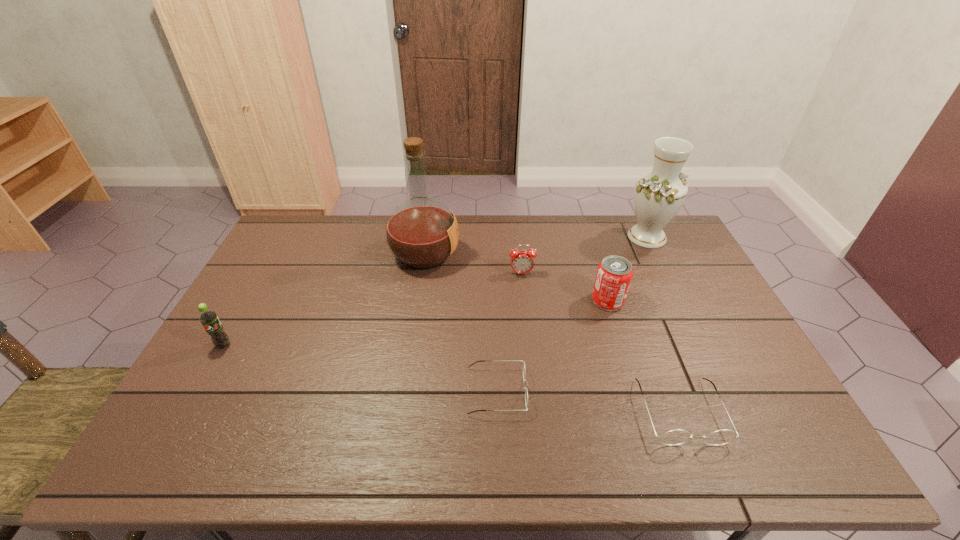
Locate an element on the screen. The height and width of the screenshot is (540, 960). vacant space located on the front-facing side of the shortest object is located at coordinates (629, 391).

Locate an element on the screen. The width and height of the screenshot is (960, 540). vacant region located 0.350m on the left of the second tallest object is located at coordinates (527, 237).

Locate an element on the screen. This screenshot has height=540, width=960. free space located on the face of the alarm clock is located at coordinates (530, 350).

Find the location of a particular element. This screenshot has width=960, height=540. vacant region located 0.170m on the front label of the liquor is located at coordinates (509, 255).

You are a GUI agent. You are given a task and a screenshot of the screen. Output one action in this format:
    pyautogui.click(x=<x>, y=<y>)
    Task: Click on the vacant space located on the right of the can
    Image resolution: width=960 pixels, height=540 pixels.
    Given the screenshot: What is the action you would take?
    (x=673, y=301)

The height and width of the screenshot is (540, 960). What are the coordinates of `vacant space located 0.110m on the front label of the soda` in the screenshot? It's located at (202, 384).

This screenshot has width=960, height=540. I want to click on vase that is positioned at the far edge, so click(x=658, y=196).

The height and width of the screenshot is (540, 960). What are the coordinates of `liquor situated at the far edge` in the screenshot? It's located at (422, 233).

Locate an element on the screen. object present at the left edge is located at coordinates (209, 319).

Image resolution: width=960 pixels, height=540 pixels. Find the location of `spectacles present at the right edge`. spectacles present at the right edge is located at coordinates (676, 437).